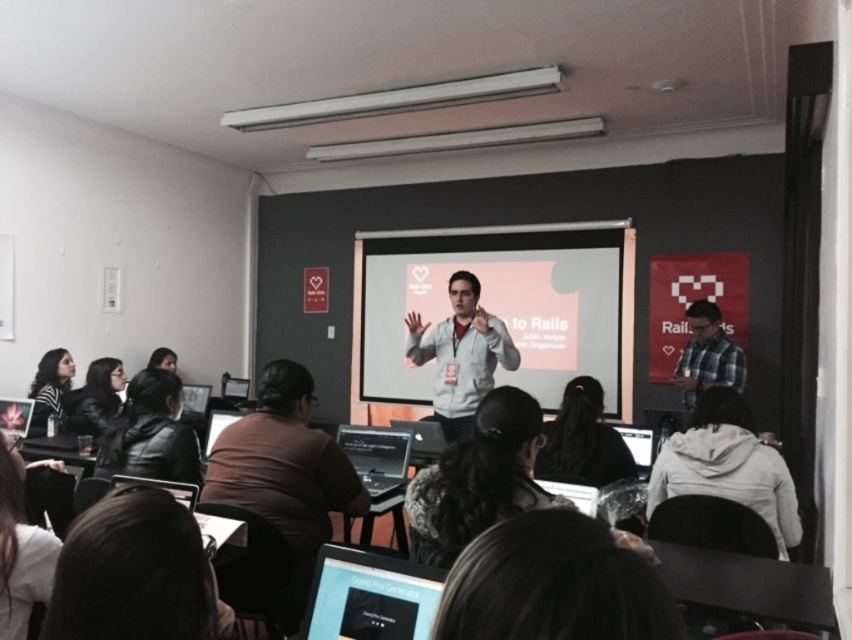
Question: Which is nearer to the brown leather jacket at center?

Choices:
 (A) white matte projector screen at center
 (B) white matte shirt at center

Answer: (B)

Question: Can you confirm if brown leather jacket at lower left is wider than striped sweater at lower left?

Choices:
 (A) yes
 (B) no

Answer: (B)

Question: Does white matte shirt at center have a greater width compared to plaid fabric shirt at center?

Choices:
 (A) yes
 (B) no

Answer: (A)

Question: Is brown leather jacket at center to the right of white matte shirt at center from the viewer's perspective?

Choices:
 (A) no
 (B) yes

Answer: (A)

Question: Which point is farther to the camera?

Choices:
 (A) (223, 456)
 (B) (58, 620)
 (C) (699, 330)

Answer: (C)

Question: Which of the following is the farthest from the observer?

Choices:
 (A) (714, 326)
 (B) (62, 358)
 (C) (181, 438)
 (D) (286, 506)

Answer: (B)